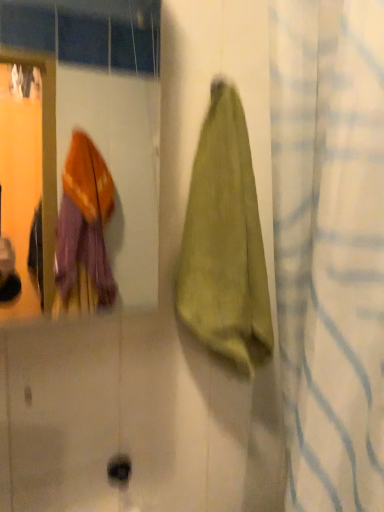
Image resolution: width=384 pixels, height=512 pixels. Describe the element at coordinates (330, 247) in the screenshot. I see `green fabric towel at right` at that location.

Identify the location of green fabric towel at right. (330, 247).

Where is `green fabric towel at center`? Image resolution: width=384 pixels, height=512 pixels. green fabric towel at center is located at coordinates (225, 242).

What do you see at coordinates (225, 242) in the screenshot? Image resolution: width=384 pixels, height=512 pixels. I see `green fabric towel at center` at bounding box center [225, 242].

In order to face green fabric towel at center, should I rotate leftwards or rightwards?

Turn right approximately 3.649 degrees to face it.

This screenshot has width=384, height=512. Identify the location of green fabric towel at right. (330, 247).

Does green fabric towel at right appear on the right side of green fabric towel at center?

Yes.

Is green fabric towel at right closer to the viewer compared to green fabric towel at center?

Yes, green fabric towel at right is closer to the camera.

Is point (336, 442) in front of point (182, 262)?

That is True.

From the image's perspective, between green fabric towel at right and green fabric towel at center, which one is located above?

green fabric towel at center appears higher in the image.

From a real-world perspective, who is located lower, green fabric towel at right or green fabric towel at center?

From a 3D spatial view, green fabric towel at right is below.

Does green fabric towel at right have a greater width compared to green fabric towel at center?

Indeed, green fabric towel at right has a greater width compared to green fabric towel at center.

Is green fabric towel at right taller than green fabric towel at center?

Yes.

Is green fabric towel at right bigger or smaller than green fabric towel at center?

In the image, green fabric towel at right appears to be larger than green fabric towel at center.

Is green fabric towel at center a part of green fabric towel at right?

Yes, green fabric towel at center is inside green fabric towel at right.

Is green fabric towel at right not near green fabric towel at center?

No.

Is green fabric towel at right oriented towards green fabric towel at center?

Yes, green fabric towel at right is turned towards green fabric towel at center.

What's the angular difference between green fabric towel at right and green fabric towel at center's facing directions?

There is a 92.3-degree angle between the facing directions of green fabric towel at right and green fabric towel at center.

Measure the distance between green fabric towel at right and green fabric towel at center.

green fabric towel at right and green fabric towel at center are 6.23 inches apart from each other.

There is a green fabric towel at right. What are the coordinates of `towel above it (from a real-world perspective)` in the screenshot? It's located at (225, 242).

Is green fabric towel at center to the left of green fabric towel at right from the viewer's perspective?

Yes.

Does green fabric towel at center lie behind green fabric towel at right?

Yes, the depth of green fabric towel at center is greater than that of green fabric towel at right.

Which point is more distant from viewer, (220, 192) or (350, 495)?

The point (220, 192) is behind.

From the image's perspective, which object appears higher, green fabric towel at center or green fabric towel at right?

From the image's view, green fabric towel at center is above.

Based on the photo, from a real-world perspective, is green fabric towel at center located higher than green fabric towel at right?

Yes, from a real-world perspective, green fabric towel at center is above green fabric towel at right.

Consider the image. Is green fabric towel at center wider than green fabric towel at right?

No.

Considering the relative sizes of green fabric towel at center and green fabric towel at right in the image provided, is green fabric towel at center taller than green fabric towel at right?

In fact, green fabric towel at center may be shorter than green fabric towel at right.

Considering the relative sizes of green fabric towel at center and green fabric towel at right in the image provided, is green fabric towel at center bigger than green fabric towel at right?

A: No, green fabric towel at center is not bigger than green fabric towel at right.

Do you think green fabric towel at center is within green fabric towel at right, or outside of it?

green fabric towel at center can be found inside green fabric towel at right.

Is the surface of green fabric towel at center in direct contact with green fabric towel at right?

There is a gap between green fabric towel at center and green fabric towel at right.

Is green fabric towel at center facing towards green fabric towel at right?

No, green fabric towel at center is not aimed at green fabric towel at right.

Can you tell me how much green fabric towel at center and green fabric towel at right differ in facing direction?

There is a 92.3-degree angle between the facing directions of green fabric towel at center and green fabric towel at right.

I want to click on curtain on the right of green fabric towel at center, so click(x=330, y=247).

Image resolution: width=384 pixels, height=512 pixels. What are the coordinates of `towel above the green fabric towel at right (from a real-world perspective)` in the screenshot? It's located at (225, 242).

Identify the location of curtain in front of the green fabric towel at center. The image size is (384, 512). (330, 247).